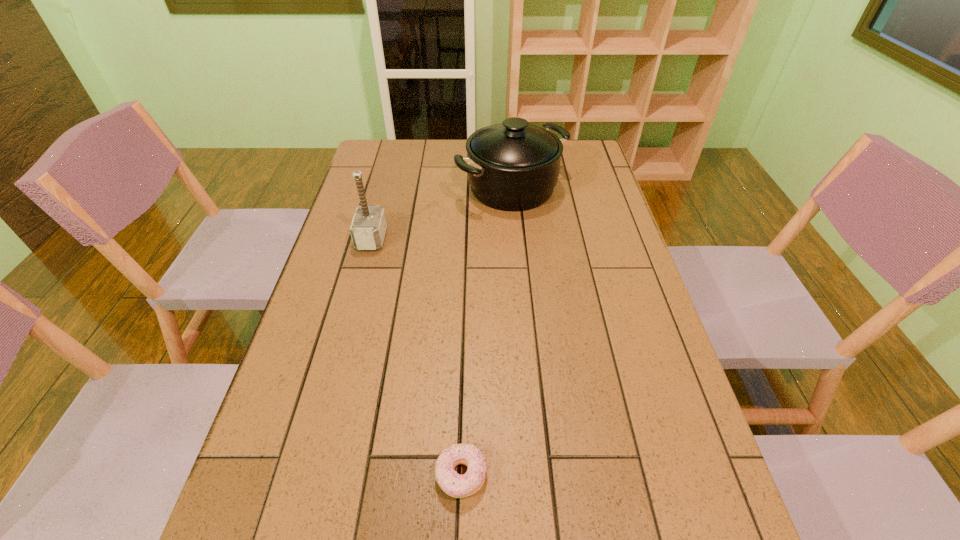
Where is `object present at the right edge`? object present at the right edge is located at coordinates (513, 166).

This screenshot has height=540, width=960. Identify the location of object positioned at the far right corner. (x=513, y=166).

The height and width of the screenshot is (540, 960). I want to click on free space at the far edge, so click(441, 148).

The height and width of the screenshot is (540, 960). I want to click on vacant area at the left edge, so click(380, 198).

Where is `vacant region at the right edge of the desktop`? This screenshot has width=960, height=540. vacant region at the right edge of the desktop is located at coordinates (618, 403).

The height and width of the screenshot is (540, 960). In order to click on free space between the saucepan and the shortest object in this screenshot , I will do `click(487, 332)`.

Identify the location of vacant space that is in between the hammer and the saucepan. This screenshot has height=540, width=960. (442, 213).

Locate an element on the screen. The image size is (960, 540). vacant area that lies between the saucepan and the second farthest object is located at coordinates (442, 213).

Find the location of a particular element. This screenshot has height=540, width=960. unoccupied area between the second nearest object and the farthest object is located at coordinates (442, 213).

This screenshot has width=960, height=540. I want to click on free space between the saucepan and the second nearest object, so click(x=442, y=213).